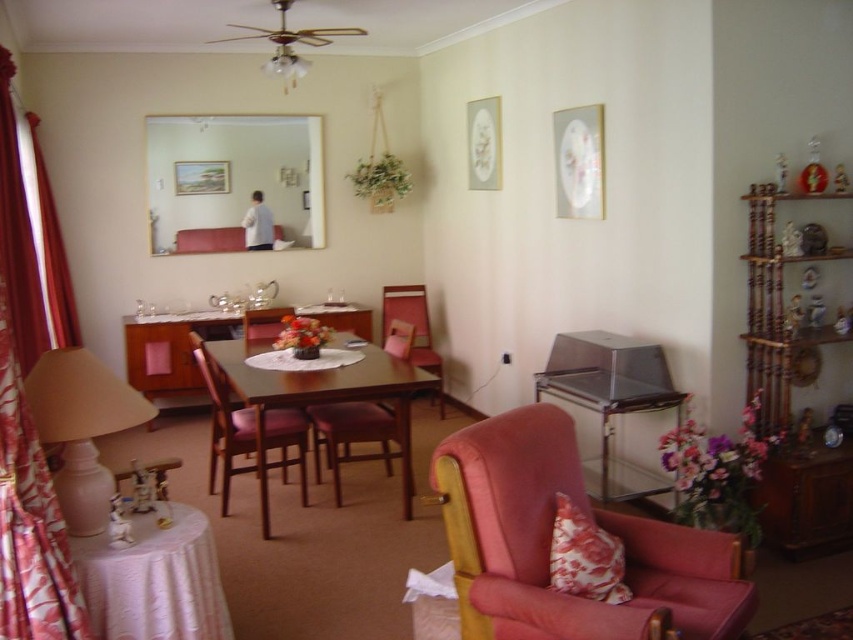
You are planning to place a new rectangular coffee table in the dining area. The table requires at least 1 meter of space on all sides to ensure easy access. Based on the current setup, can the velvet pink armchair at center and the floral fabric pillow at lower right be positioned such that the coffee table can fit without encroaching on their space?

The velvet pink armchair at center might be wider than the floral fabric pillow at lower right, but without specific measurements, it is uncertain if there is enough space to place the coffee table without overlapping their areas. Further details about their exact dimensions would be needed to confirm.

Based on the photo, you are a guest entering the dining area and want to sit down. The velvet pink armchair at center and the floral fabric pillow at lower right are both available. Which one is more suitable for sitting?

The velvet pink armchair at center is much taller than the floral fabric pillow at lower right, so it is more suitable for sitting.

You are sitting at the dining area and want to place your phone on the mahogany wooden table at center. Since you are sitting on the wooden chair at center, which object is closer to you?

The wooden chair at center is closer to you because you are sitting on it, while the mahogany wooden table at center is positioned further away from you.